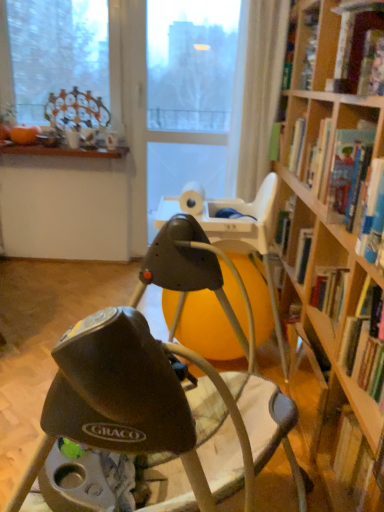
Question: Does point (349, 182) appear closer or farther from the camera than point (365, 326)?

Choices:
 (A) closer
 (B) farther

Answer: (B)

Question: Considering the relative positions of hardcover book at upper right, arranged as the second book when ordered from the bottom, and hardcover book at right, which is the 3th book in top-to-bottom order, in the image provided, is hardcover book at upper right, arranged as the second book when ordered from the bottom, to the left or to the right of hardcover book at right, which is the 3th book in top-to-bottom order,?

Choices:
 (A) right
 (B) left

Answer: (B)

Question: Which object is positioned closest to the matte black baby swing at center?

Choices:
 (A) hardcover book at upper right, arranged as the second book when ordered from the bottom
 (B) hardcover book at right, which is the first book from bottom to top
 (C) transparent plastic screen door at center
 (D) hardcover book at upper right, which is counted as the 3th book, starting from the bottom

Answer: (B)

Question: Considering the real-world distances, which object is closest to the hardcover book at upper right, arranged as the second book when ordered from the bottom?

Choices:
 (A) hardcover book at upper right, the 1th book in the top-to-bottom sequence
 (B) matte black baby swing at center
 (C) transparent plastic screen door at center
 (D) hardcover book at right, which is the first book from bottom to top

Answer: (A)